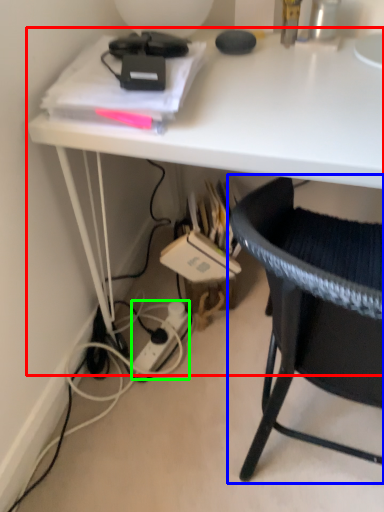
Question: Based on their relative distances, which object is farther from desk (highlighted by a red box)? Choose from chair (highlighted by a blue box) and power outlet (highlighted by a green box).

Choices:
 (A) chair
 (B) power outlet

Answer: (B)